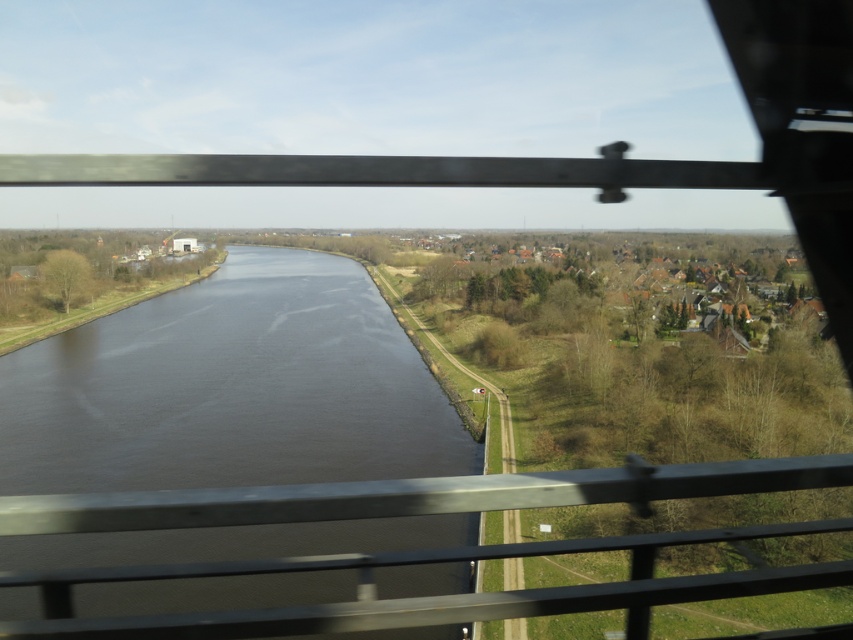
You are a photographer standing on the bridge and want to capture both the dark water at center and the metallic gray rail at center in your shot. Which object will occupy more space in your photo?

The dark water at center has a larger size compared to the metallic gray rail at center, so it will occupy more space in the photo.